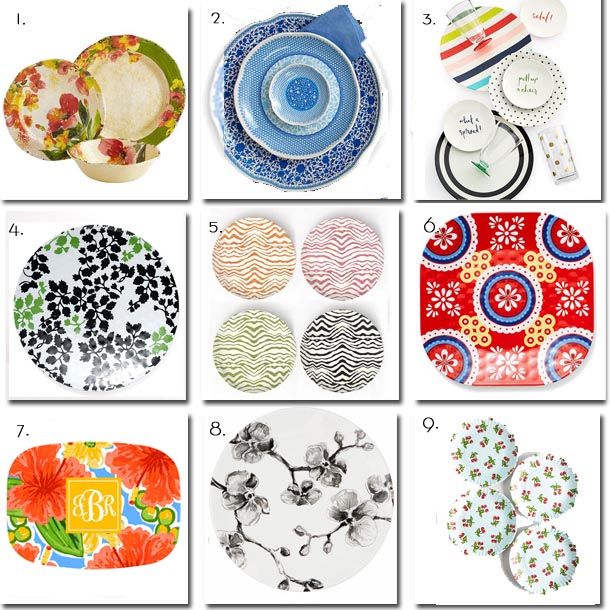
Where is `plate with black and green leaves`? The height and width of the screenshot is (610, 610). plate with black and green leaves is located at coordinates (115, 316).